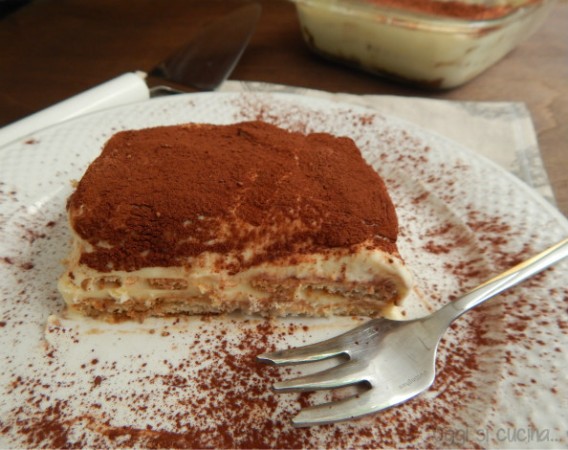
Image resolution: width=568 pixels, height=450 pixels. I want to click on table, so click(x=549, y=64).